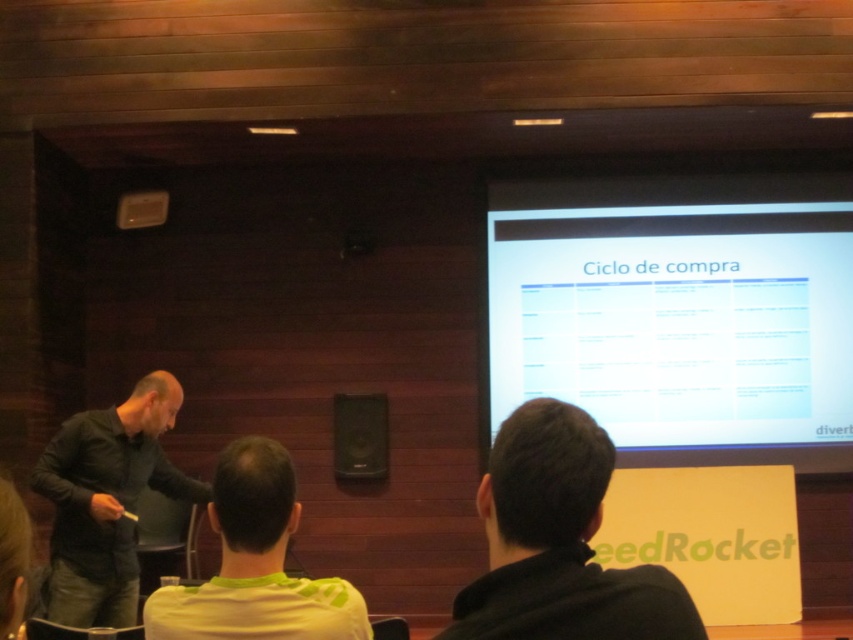
Which of these two, white matte shirt at lower center or black matte speaker at center, stands taller?

black matte speaker at center

Is point (286, 545) behind point (345, 474)?

No, it is not.

You are a GUI agent. You are given a task and a screenshot of the screen. Output one action in this format:
    pyautogui.click(x=<x>, y=<y>)
    Task: Click on the white matte shirt at lower center
    Image resolution: width=853 pixels, height=640 pixels.
    Given the screenshot: What is the action you would take?
    pyautogui.click(x=254, y=563)

Is white glossy projection screen at upper right shorter than black matte speaker at center?

No.

The height and width of the screenshot is (640, 853). I want to click on white glossy projection screen at upper right, so click(679, 314).

Who is more forward, [648,308] or [387,420]?

Point [648,308]

This screenshot has width=853, height=640. In order to click on white glossy projection screen at upper right in this screenshot , I will do `click(679, 314)`.

Can you confirm if black matte shirt at left is shorter than black matte speaker at center?

In fact, black matte shirt at left may be taller than black matte speaker at center.

You are a GUI agent. You are given a task and a screenshot of the screen. Output one action in this format:
    pyautogui.click(x=<x>, y=<y>)
    Task: Click on the black matte shirt at left
    This screenshot has height=640, width=853.
    Given the screenshot: What is the action you would take?
    pyautogui.click(x=107, y=500)

Locate an element on the screen. The height and width of the screenshot is (640, 853). black matte shirt at left is located at coordinates (107, 500).